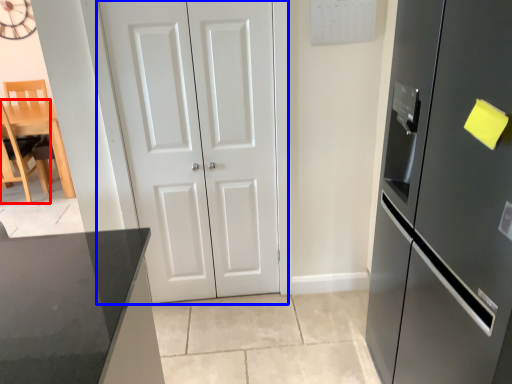
Question: Among these objects, which one is farthest to the camera, chair (highlighted by a red box) or door (highlighted by a blue box)?

Choices:
 (A) chair
 (B) door

Answer: (A)